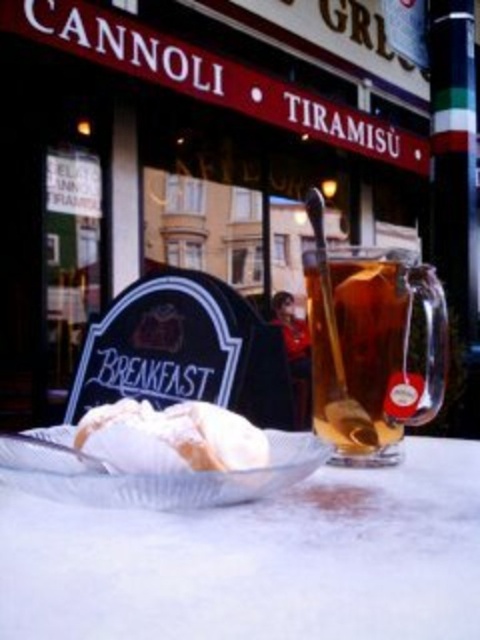
Question: Is translucent glass carafe at center to the right of clear glass plate at center from the viewer's perspective?

Choices:
 (A) yes
 (B) no

Answer: (A)

Question: Which of these objects is positioned closest to the white powdered sugar at center?

Choices:
 (A) translucent glass carafe at center
 (B) white glossy table at center

Answer: (B)

Question: Which object is positioned farthest from the translucent glass carafe at center?

Choices:
 (A) white glossy table at center
 (B) white powdered sugar at center
 (C) clear glass plate at center

Answer: (B)

Question: Which of the following is the farthest from the observer?

Choices:
 (A) (389, 355)
 (B) (244, 438)
 (C) (386, 506)

Answer: (A)

Question: Is translucent glass carafe at center positioned before white powdered sugar at center?

Choices:
 (A) yes
 (B) no

Answer: (B)

Question: Does clear glass plate at center come in front of white powdered sugar at center?

Choices:
 (A) no
 (B) yes

Answer: (B)